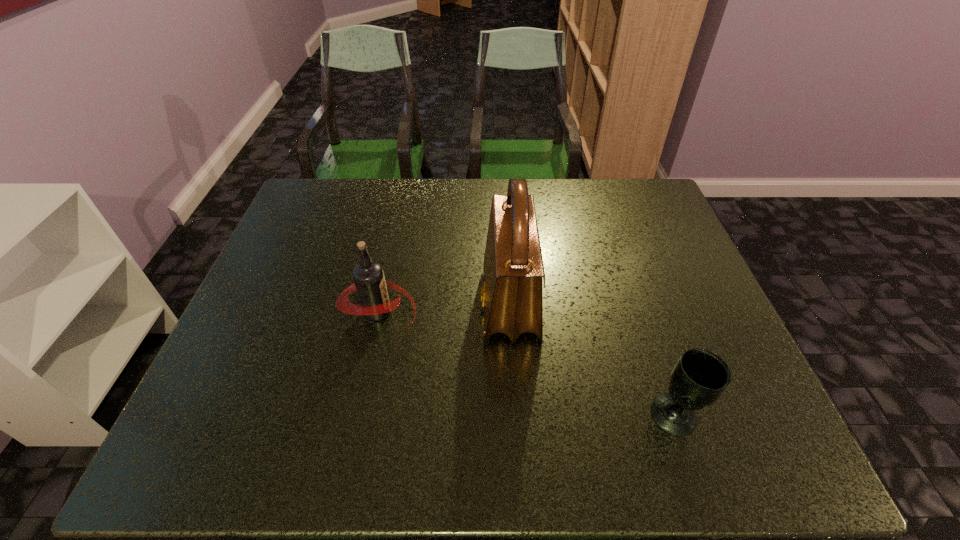
Image resolution: width=960 pixels, height=540 pixels. Find the location of `vacant space located on the back of the nearest object`. vacant space located on the back of the nearest object is located at coordinates (654, 352).

Locate an element on the screen. Image resolution: width=960 pixels, height=540 pixels. object positioned at the near edge is located at coordinates (699, 378).

Where is `object at the right edge`? The width and height of the screenshot is (960, 540). object at the right edge is located at coordinates (699, 378).

You are a GUI agent. You are given a task and a screenshot of the screen. Output one action in this format:
    pyautogui.click(x=<x>, y=<y>)
    Task: Click on the object positioned at the near right corner
    This screenshot has width=960, height=540.
    Given the screenshot: What is the action you would take?
    pyautogui.click(x=699, y=378)

Identify the location of vacant space at the far edge. (379, 191).

This screenshot has width=960, height=540. In the image, there is a desktop. What are the coordinates of `free space at the near edge` in the screenshot? It's located at (487, 441).

The width and height of the screenshot is (960, 540). I want to click on blank space at the left edge of the desktop, so click(x=292, y=327).

Identify the location of vacant region at the right edge. (683, 269).

Find the location of a particular element. free space between the second tallest object and the rightmost object is located at coordinates (526, 363).

This screenshot has width=960, height=540. Identify the location of empty space between the second object from left to right and the leftmost object. (444, 308).